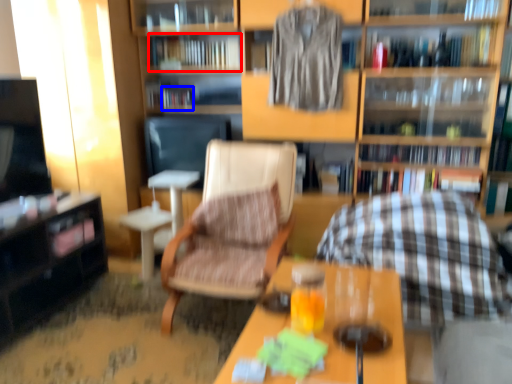
Question: Which of the following is the farthest to the observer, book (highlighted by a red box) or book (highlighted by a blue box)?

Choices:
 (A) book
 (B) book

Answer: (B)